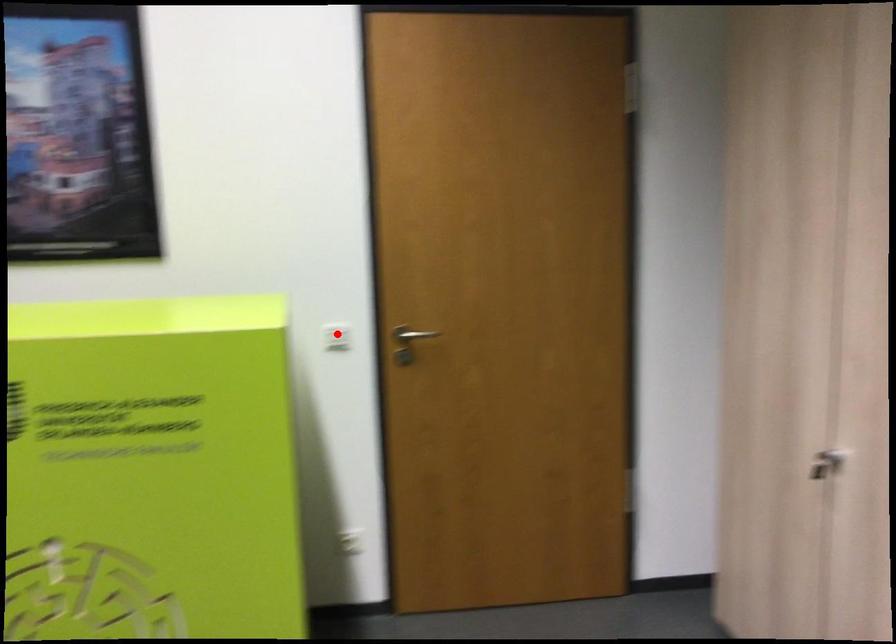
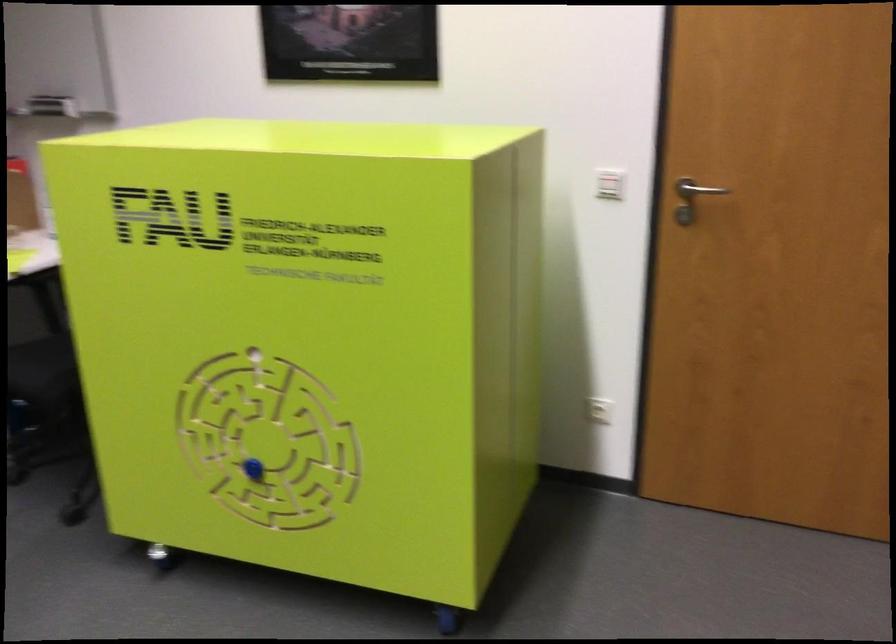
Question: I am providing you with two images of the same scene from different viewpoints. In image1, a red point is highlighted. Considering the same 3D point in image2, which of the following is correct?

Choices:
 (A) It is closer
 (B) It is farther

Answer: (A)